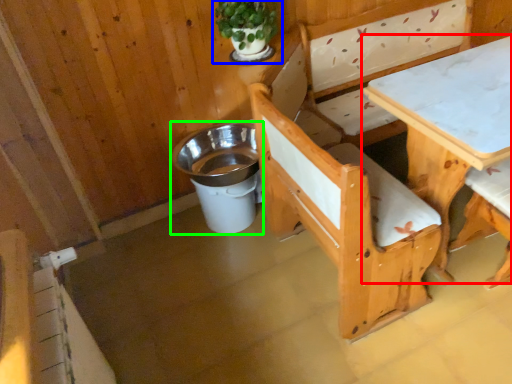
Question: Considering the real-world distances, which object is farthest from table (highlighted by a red box)? houseplant (highlighted by a blue box) or trash bin/can (highlighted by a green box)?

Choices:
 (A) houseplant
 (B) trash bin/can

Answer: (B)